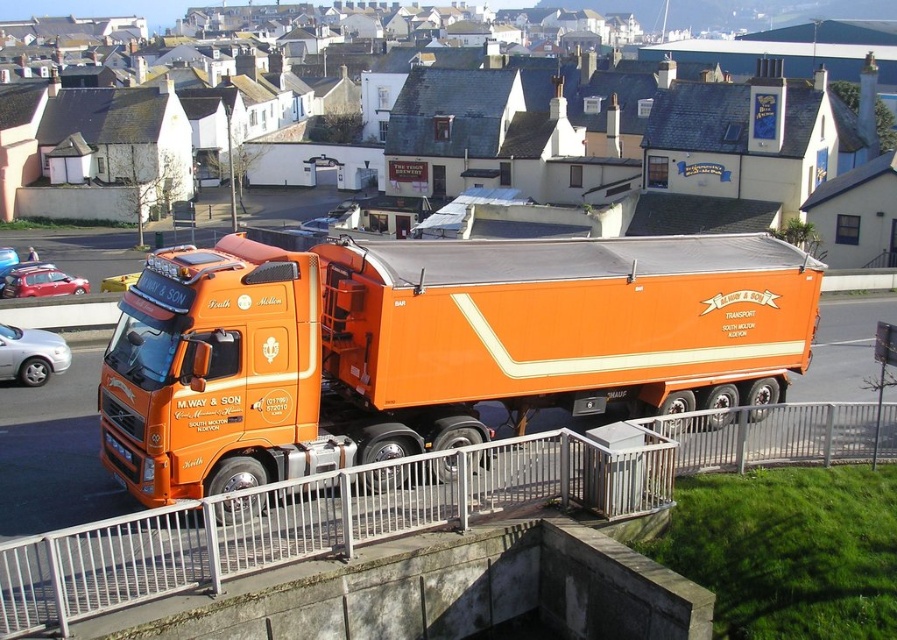
You are standing on the sidewalk next to the silver metallic sedan at lower left. You want to cross the street to reach the orange articulated lorry parked ahead. The road is 30 feet wide. Can you safely cross the road without needing to walk backward?

The silver metallic sedan at lower left is 67.00 feet away from the viewer. Since the road is only 30 feet wide, the distance from the sedan to the lorry would require crossing the road, but the sedan is positioned at the lower left, so you can safely cross the 30 feet road to reach the lorry without needing to backtrack.

You are a delivery driver who needs to park your orange matte truck at center between two parked cars. The space between the two cars has a white metal railing at center in the middle. Can your truck fit in the space without touching the railing?

The orange matte truck at center is wider than the white metal railing at center, so it cannot fit in the space between the two cars without touching the railing.

You are a delivery driver who needs to park your van between the silver metallic sedan at lower left and the shiny red car at left. The van is 6 meters long. Is there enough space between them to park your van?

The distance between the silver metallic sedan at lower left and the shiny red car at left is 15.26 meters. Since the van is 6 meters long, there is sufficient space to park between them.